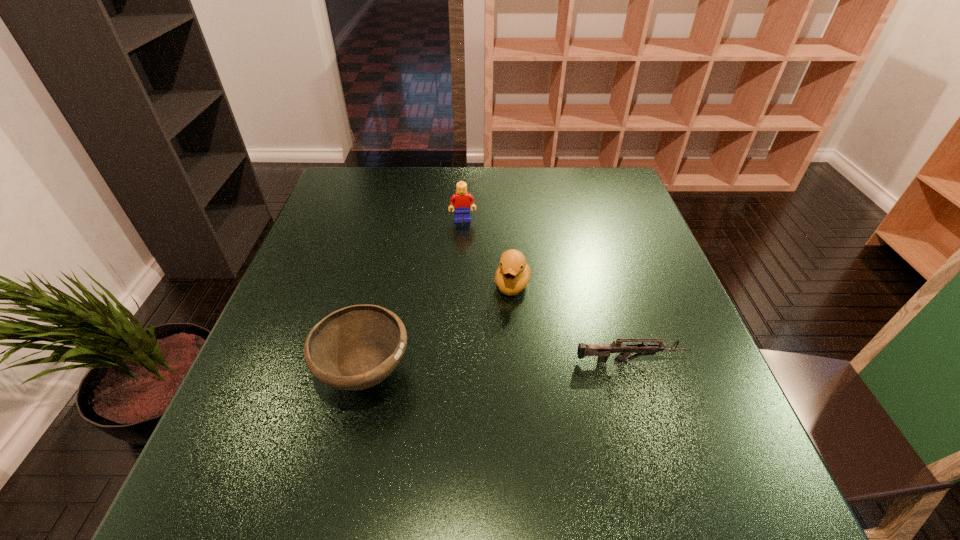
Find the location of a particular element. This screenshot has width=960, height=540. vacant spot on the desktop that is between the bowl and the shortest object and is positioned on the face of the third object from right to left is located at coordinates (476, 368).

Find the location of a particular element. This screenshot has height=540, width=960. free space on the desktop that is between the leftmost object and the rightmost object and is positioned on the face of the duckling is located at coordinates point(492,367).